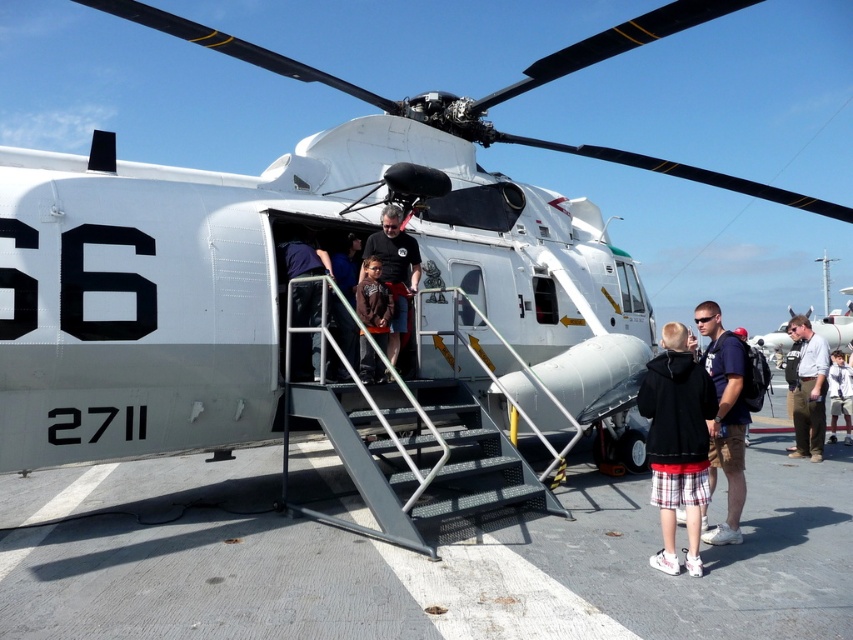
Can you confirm if dark blue uniform at center is wider than white shirt at right?

No.

Describe the element at coordinates (302, 256) in the screenshot. Image resolution: width=853 pixels, height=640 pixels. I see `dark blue uniform at center` at that location.

You are a GUI agent. You are given a task and a screenshot of the screen. Output one action in this format:
    pyautogui.click(x=<x>, y=<y>)
    Task: Click on the dark blue uniform at center
    The image size is (853, 640).
    Given the screenshot: What is the action you would take?
    pyautogui.click(x=302, y=256)

Between metallic gray stairs at center and black hoodie at lower right, which one has less height?

metallic gray stairs at center is shorter.

Which is below, metallic gray stairs at center or black hoodie at lower right?

metallic gray stairs at center is below.

Between point (461, 477) and point (682, 356), which one is positioned in front?

Positioned in front is point (682, 356).

Locate an element on the screen. metallic gray stairs at center is located at coordinates (473, 464).

Based on the photo, does metallic gray stairs at center appear under white shirt at right?

Yes.

Is metallic gray stairs at center above white shirt at right?

No.

Who is more distant from viewer, (357, 470) or (817, 372)?

Point (817, 372)

At what (x,y) coordinates should I click in order to perform the action: click on metallic gray stairs at center. Please return your answer as a coordinate pair (x, y). The image size is (853, 640). Looking at the image, I should click on (473, 464).